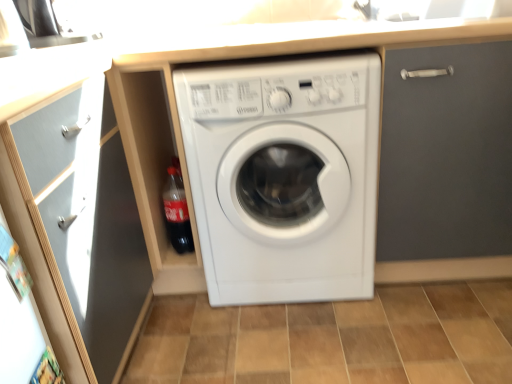
Question: From the image's perspective, is white plastic washing machine at center located above or below matte gray door at upper right?

Choices:
 (A) above
 (B) below

Answer: (B)

Question: Is white plastic washing machine at center bigger or smaller than matte gray door at upper right?

Choices:
 (A) small
 (B) big

Answer: (B)

Question: Based on their relative distances, which object is nearer to the white plastic washing machine at center?

Choices:
 (A) transparent glass door at left
 (B) translucent plastic bottle at lower left
 (C) brown tile at center
 (D) matte gray door at upper right

Answer: (D)

Question: Considering the real-world distances, which object is closest to the translucent plastic bottle at lower left?

Choices:
 (A) transparent glass door at left
 (B) white plastic washing machine at center
 (C) matte gray door at upper right
 (D) brown tile at center

Answer: (B)